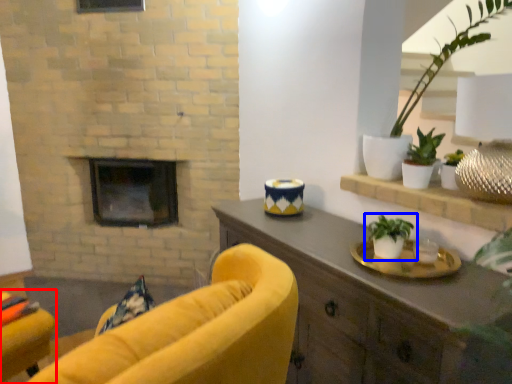
Question: Which object appears closest to the camera in this image, chair (highlighted by a red box) or houseplant (highlighted by a blue box)?

Choices:
 (A) chair
 (B) houseplant

Answer: (B)